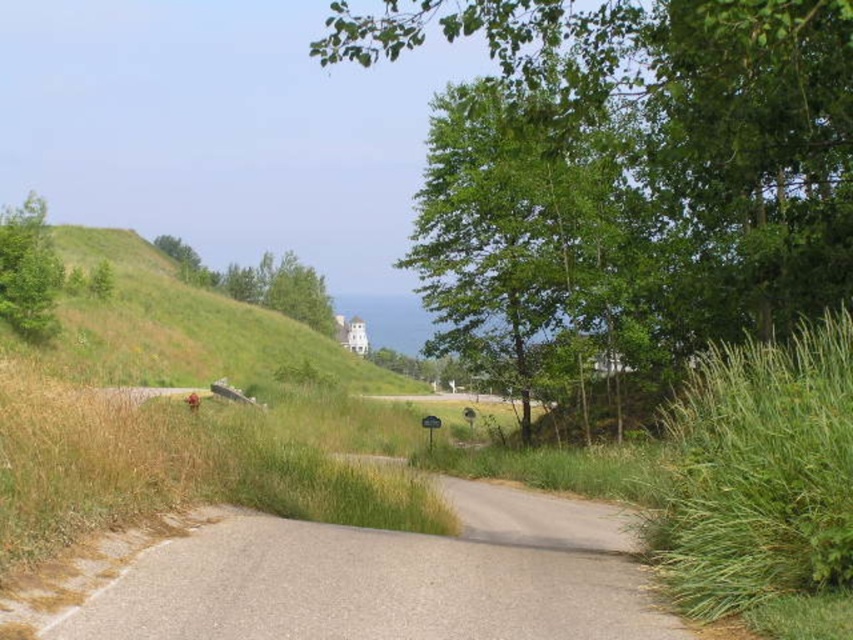
You are standing at the center of the road in the image. Which direction should you look to see the green leafy tree at upper center?

The green leafy tree at upper center is located at point (624,172), which is to the upper left direction from your current position at the center of the road.

You are a hiker standing at the start of the paved road and want to walk towards the green leafy tree at upper center. Which direction should you turn to avoid the green leafy tree at upper left?

Since the green leafy tree at upper center is positioned on the right side of green leafy tree at upper left, you should turn right to head towards the green leafy tree at upper center and avoid the green leafy tree at upper left.

Consider the image. You are a cyclist planning to ride along the gray asphalt path at center. There is a green leafy tree at center nearby. Considering their widths, which one is narrower?

The gray asphalt path at center is narrower than the green leafy tree at center.